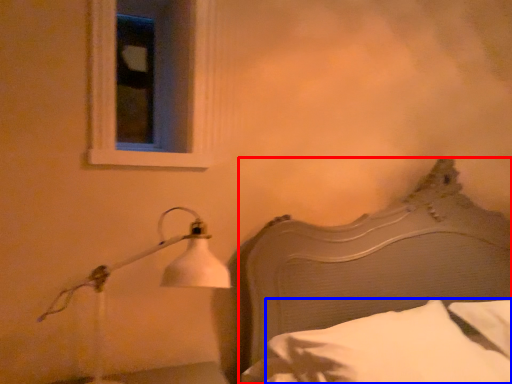
Question: Among these objects, which one is nearest to the camera, bed (highlighted by a red box) or pillow (highlighted by a blue box)?

Choices:
 (A) bed
 (B) pillow

Answer: (A)